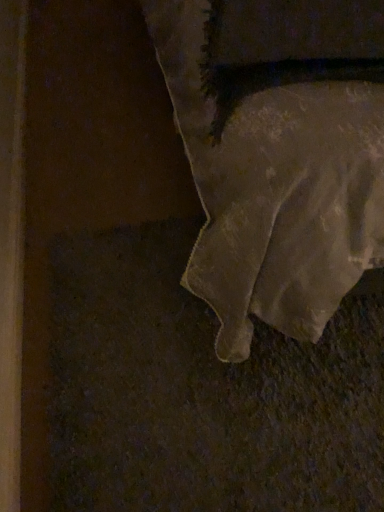
I want to click on matte white tablecloth at center, so click(x=278, y=154).

What is the approximate height of matte white tablecloth at center?

matte white tablecloth at center is 34.71 inches tall.

Describe the element at coordinates (278, 154) in the screenshot. I see `matte white tablecloth at center` at that location.

What is the approximate width of matte white tablecloth at center?

matte white tablecloth at center is 6.31 feet in width.

You are a GUI agent. You are given a task and a screenshot of the screen. Output one action in this format:
    pyautogui.click(x=<x>, y=<y>)
    Task: Click on the matte white tablecloth at center
    
    Given the screenshot: What is the action you would take?
    pyautogui.click(x=278, y=154)